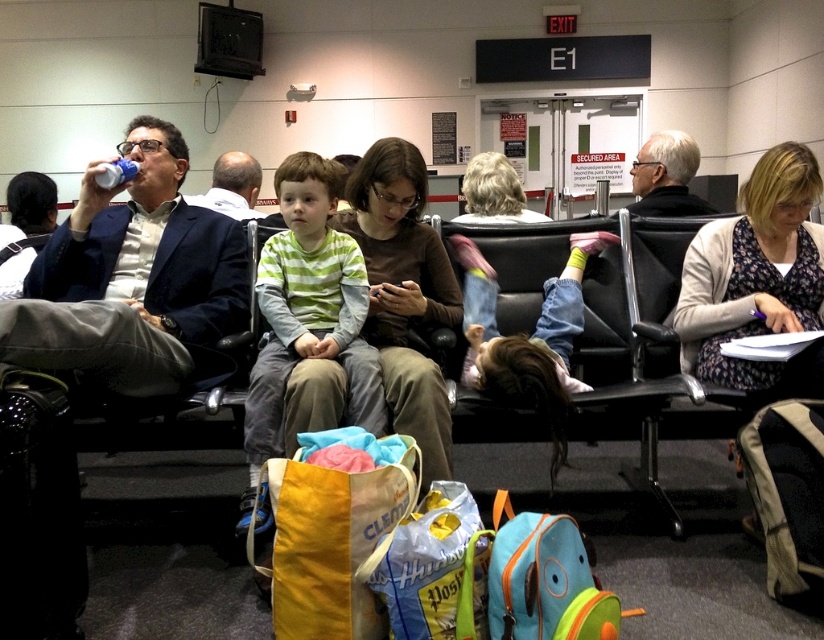
Does point (562, 260) come in front of point (267, 276)?

No, it is behind (267, 276).

Between black leather chair at center and green striped shirt at center, which one is positioned higher?

green striped shirt at center is higher up.

Is point (453, 410) less distant than point (343, 346)?

Yes, point (453, 410) is in front of point (343, 346).

Where is `black leather chair at center`? Image resolution: width=824 pixels, height=640 pixels. black leather chair at center is located at coordinates (607, 337).

Is black leather chair at center in front of denim jeans at center?

No, it is not.

Who is lower down, black leather chair at center or denim jeans at center?

black leather chair at center is lower down.

This screenshot has width=824, height=640. I want to click on black leather chair at center, so click(x=607, y=337).

Between green striped shirt at center and dark blue fabric chair at left, which one has less height?

dark blue fabric chair at left is shorter.

Who is higher up, green striped shirt at center or dark blue fabric chair at left?

green striped shirt at center

Identify the location of green striped shirt at center. (307, 317).